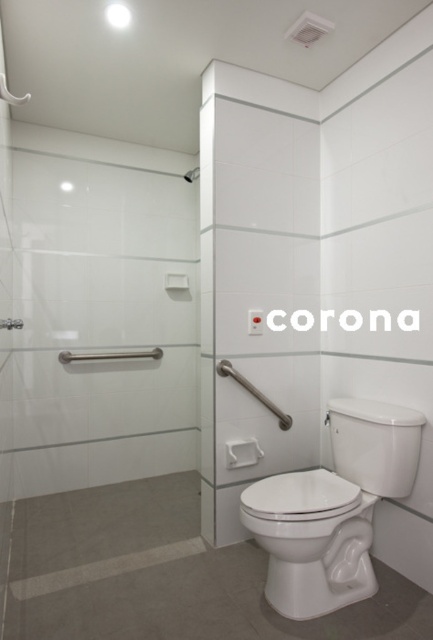
You are a delivery person holding a 24 inch wide package. You need to pass through the space between the white glossy screen door at center and the white glossy toilet at lower right. Can you fit through this space with your package?

The distance between the white glossy screen door at center and the white glossy toilet at lower right is 25.30 inches. Since the package is 24 inches wide, it is narrower than the available space. Therefore, you can fit through the space with your package.

Based on the photo, you are standing in the bathroom and need to exit through the white glossy screen door at center. To your left is the satin nickel grab bar at lower center. Which direction should you move to reach the door?

You should move to your right because the white glossy screen door at center is to the right of the satin nickel grab bar at lower center, which is on your left.